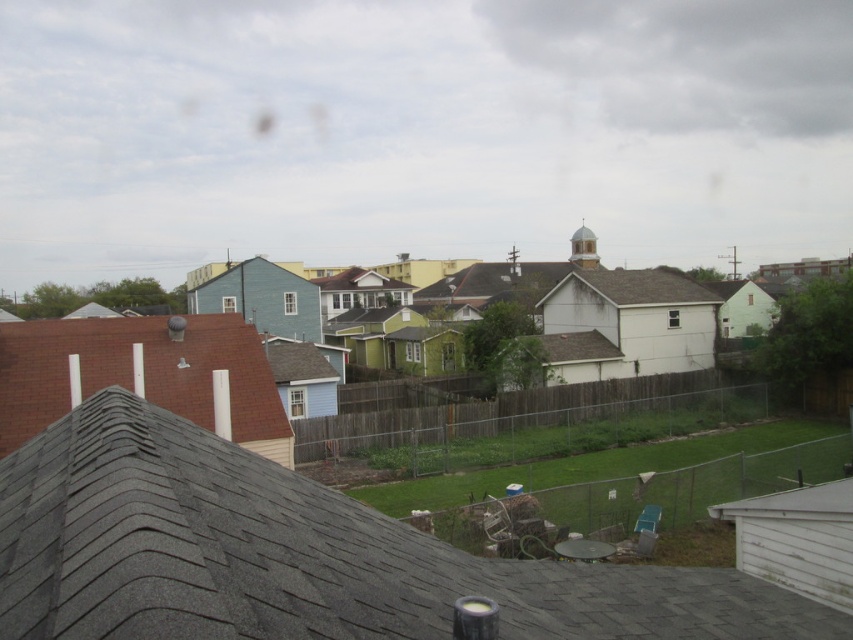
You are standing on the rooftop and looking at the gray shingles at center and the brown shingles at left. Which of these two is positioned higher up on the roof?

The brown shingles at left are positioned higher up on the roof because the gray shingles at center are located below them.

You are standing on the roof of your building and see the point at coordinates (x=299, y=556). What is located at that point?

The point at coordinates (x=299, y=556) indicates gray shingles at center.